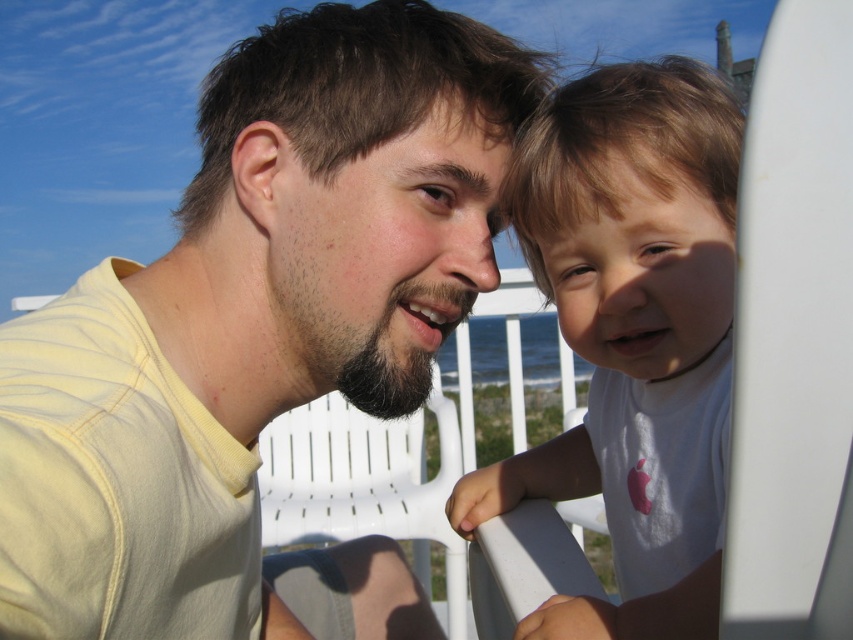
Question: Which point appears farthest from the camera in this image?

Choices:
 (A) (561, 634)
 (B) (91, 301)

Answer: (B)

Question: Which object is closer to the camera taking this photo?

Choices:
 (A) white cotton shirt at right
 (B) yellow matte shirt at upper left

Answer: (B)

Question: Is yellow matte shirt at upper left closer to the viewer compared to white cotton shirt at right?

Choices:
 (A) yes
 (B) no

Answer: (A)

Question: Which point is closer to the camera taking this photo?

Choices:
 (A) (173, 432)
 (B) (589, 88)

Answer: (A)

Question: Can you confirm if yellow matte shirt at upper left is wider than white cotton shirt at right?

Choices:
 (A) no
 (B) yes

Answer: (B)

Question: Can you confirm if yellow matte shirt at upper left is thinner than white cotton shirt at right?

Choices:
 (A) no
 (B) yes

Answer: (A)